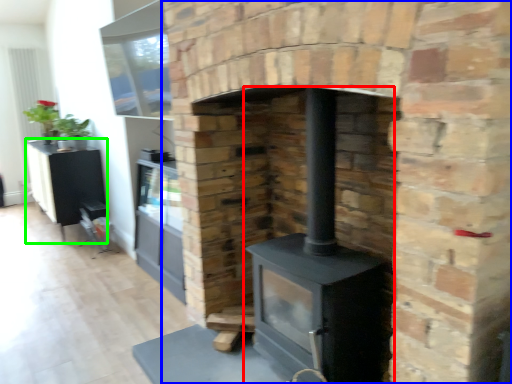
Question: Considering the real-world distances, which object is closest to wood burning stove (highlighted by a red box)? fireplace (highlighted by a blue box) or entertainment center (highlighted by a green box).

Choices:
 (A) fireplace
 (B) entertainment center

Answer: (A)